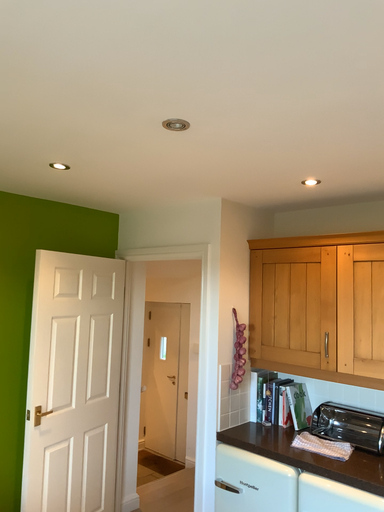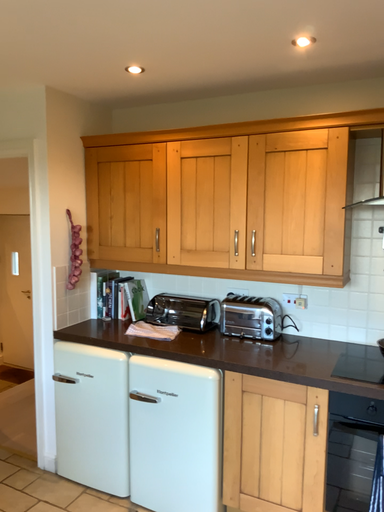
Question: Which way did the camera rotate in the video?

Choices:
 (A) rotated upward
 (B) rotated downward

Answer: (B)